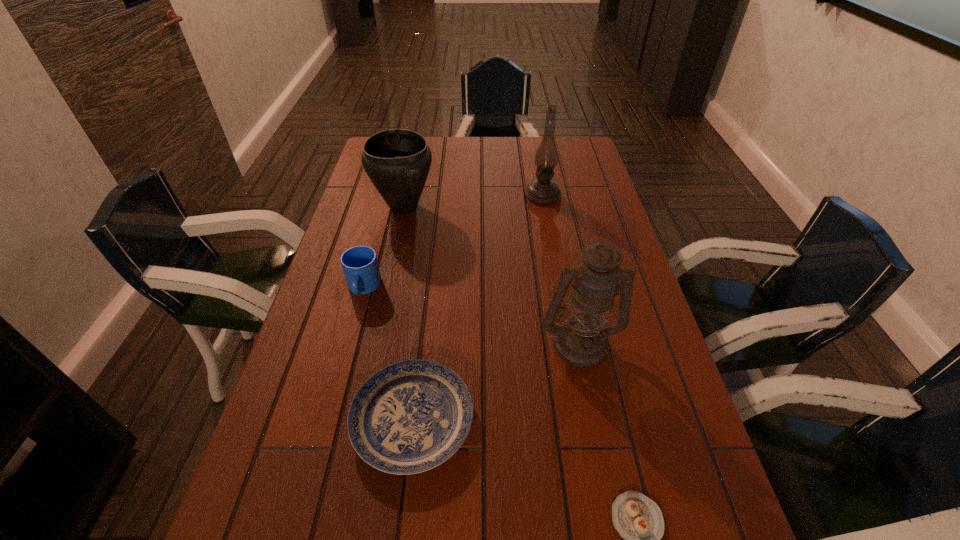
This screenshot has height=540, width=960. Find the location of `the farther oil lamp`. the farther oil lamp is located at coordinates (541, 191).

Find the location of a particular element. The image size is (960, 540). the nearer oil lamp is located at coordinates (581, 340).

At what (x,y) coordinates should I click in order to perform the action: click on urn. Please return your answer as a coordinate pair (x, y). Looking at the image, I should click on (397, 161).

The height and width of the screenshot is (540, 960). Find the location of `the third farthest object`. the third farthest object is located at coordinates (360, 265).

You are a GUI agent. You are given a task and a screenshot of the screen. Output one action in this format:
    pyautogui.click(x=<x>, y=<y>)
    Task: Click on the mug
    
    Given the screenshot: What is the action you would take?
    pyautogui.click(x=360, y=265)

Where is `plate`? The height and width of the screenshot is (540, 960). plate is located at coordinates point(411,416).

Locate an element on the screen. The width and height of the screenshot is (960, 540). vacant space positioned on the back of the farther oil lamp is located at coordinates point(533,143).

The image size is (960, 540). In order to click on vacant space positioned 0.310m on the front of the fourth farthest object in this screenshot , I will do `click(615, 516)`.

Where is `vacant point located on the right of the third tallest object`? Image resolution: width=960 pixels, height=540 pixels. vacant point located on the right of the third tallest object is located at coordinates (528, 207).

At what (x,y) coordinates should I click in order to perform the action: click on blank space located on the side of the mug with the handle. Please return your answer as a coordinate pair (x, y). The image size is (960, 540). Looking at the image, I should click on (339, 377).